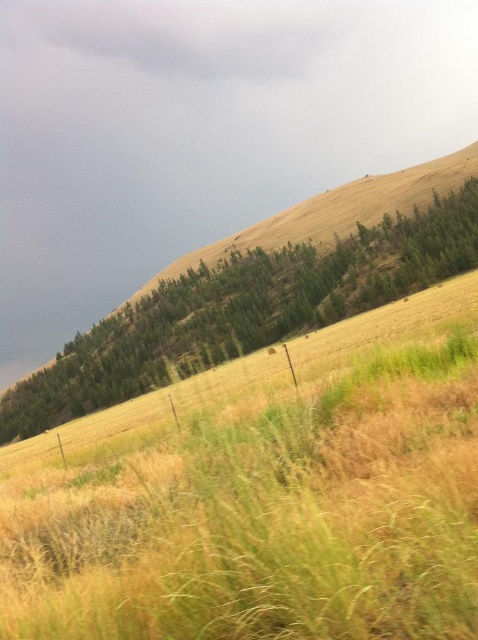
You are a hiker trying to navigate through the dry grass at upper center and the green leafy tree at upper center. Which object is located to the right of the other?

The dry grass at upper center is positioned on the right side of green leafy tree at upper center.